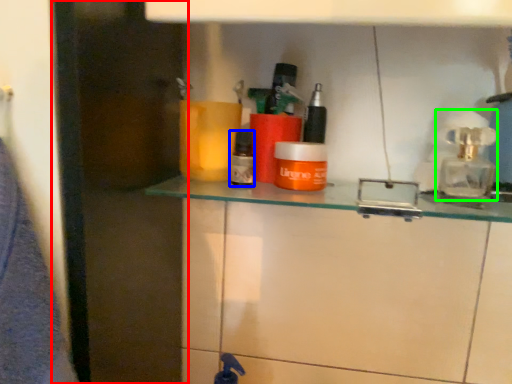
Question: Which object is the closest to the glass door (highlighted by a red box)? Choose among these: toiletry (highlighted by a blue box) or soap dispenser (highlighted by a green box).

Choices:
 (A) toiletry
 (B) soap dispenser

Answer: (A)